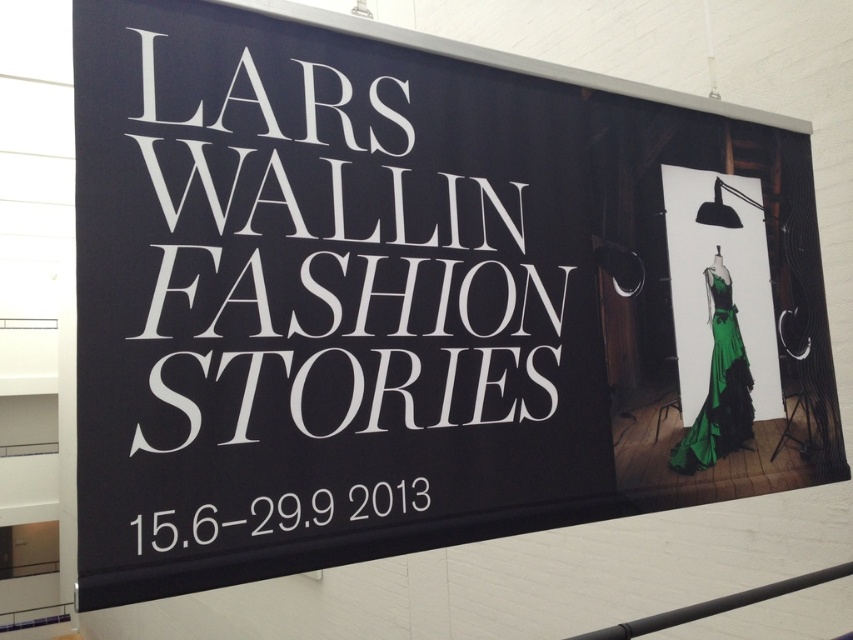
Question: Among these points, which one is farthest from the camera?

Choices:
 (A) (393, 504)
 (B) (675, 461)

Answer: (B)

Question: Is white text at center to the right of green satin dress at right from the viewer's perspective?

Choices:
 (A) no
 (B) yes

Answer: (A)

Question: Is white text at center closer to camera compared to green satin dress at right?

Choices:
 (A) no
 (B) yes

Answer: (B)

Question: Does white text at center appear under green satin dress at right?

Choices:
 (A) yes
 (B) no

Answer: (A)